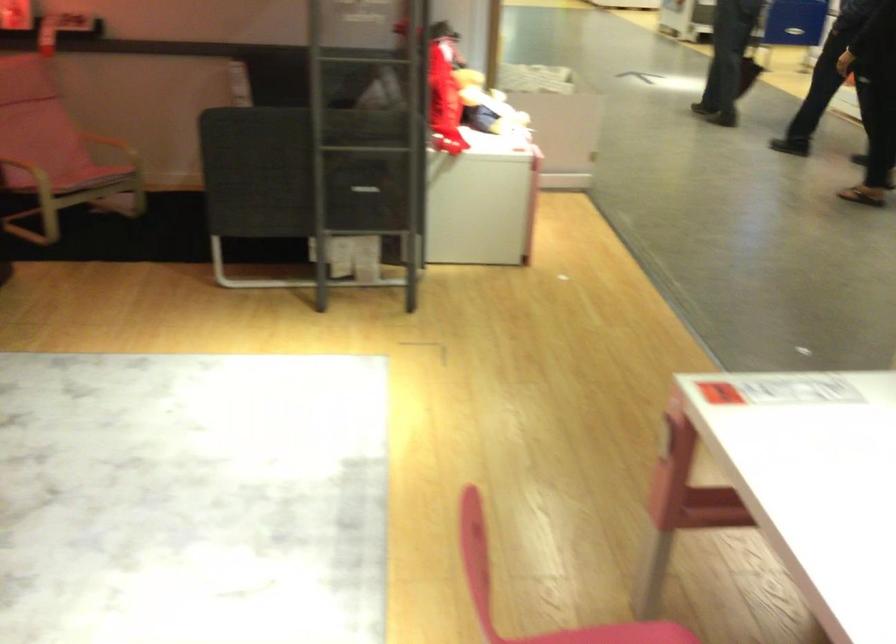
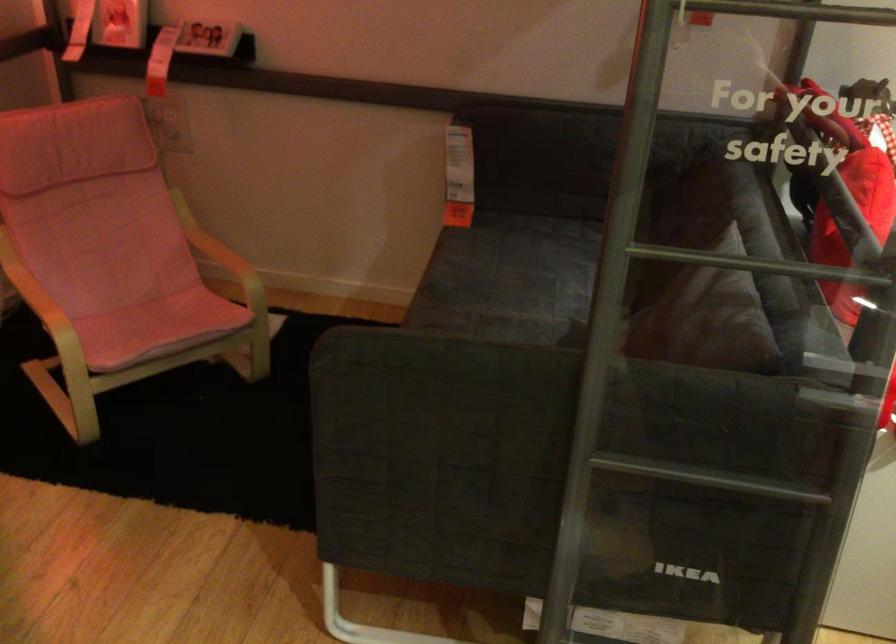
Where in the second image is the point corresponding to point (391, 67) from the first image?

(760, 263)